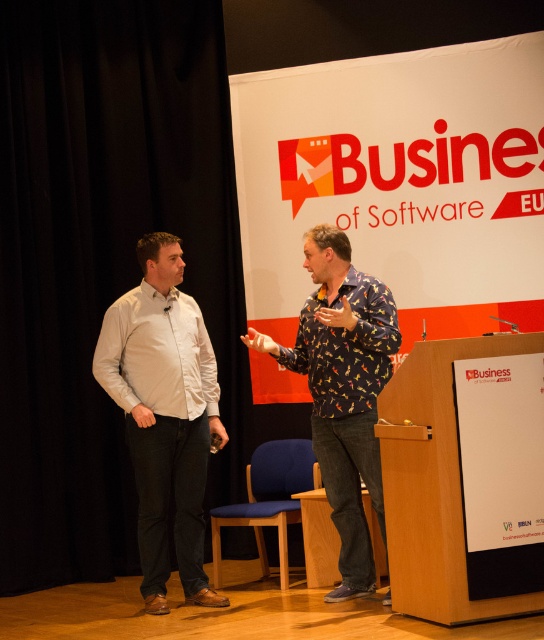
You are attending the Business of Software conference and notice two speakers on stage. One is wearing a white cotton shirt at left, and the other has a printed fabric shirt at center. From your perspective, which speaker is positioned more to the right?

The printed fabric shirt at center is positioned more to the right compared to the white cotton shirt at left.

You are an attendee at the Business of Software conference. You notice two presenters on stage. One is wearing a white cotton shirt at left and the other a printed fabric shirt at center. From your vantage point in the audience, which presenter is closer to the front of the stage?

The white cotton shirt at left is closer to the front of the stage because the printed fabric shirt at center is positioned behind it.

You are an event organizer who needs to arrange seating for the participants. You notice two shirts in the image, a white cotton shirt at left and a printed fabric shirt at center. Which shirt is positioned lower in the image?

The white cotton shirt at left is positioned below the printed fabric shirt at center, so the white cotton shirt at left is lower in the image.